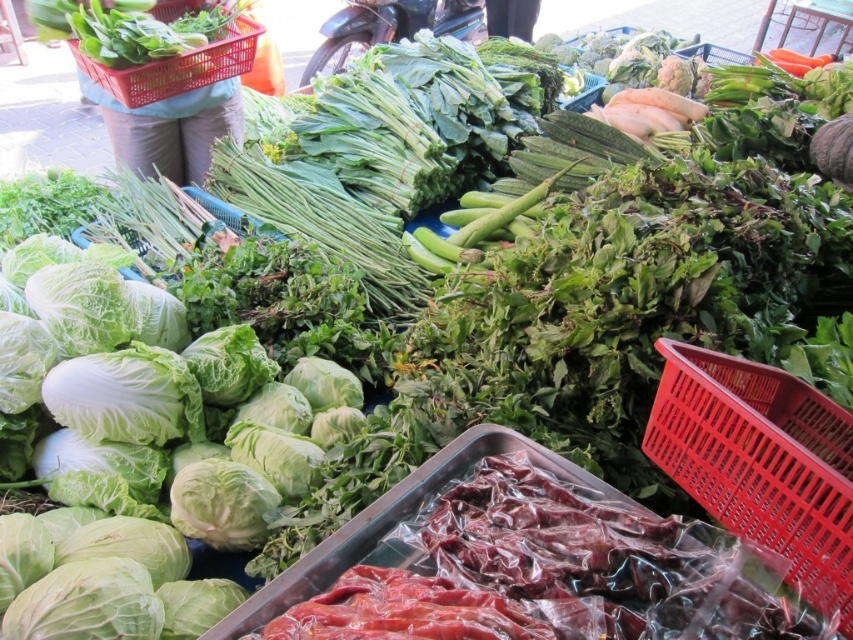
Question: Does red plastic basket at upper right appear over red plastic basket at upper left?

Choices:
 (A) yes
 (B) no

Answer: (B)

Question: Is red plastic basket at upper right bigger than red plastic basket at upper left?

Choices:
 (A) yes
 (B) no

Answer: (B)

Question: Can you confirm if red plastic basket at upper right is positioned to the right of red plastic basket at upper left?

Choices:
 (A) no
 (B) yes

Answer: (B)

Question: Which point is closer to the camera taking this photo?

Choices:
 (A) (242, 68)
 (B) (837, 476)

Answer: (B)